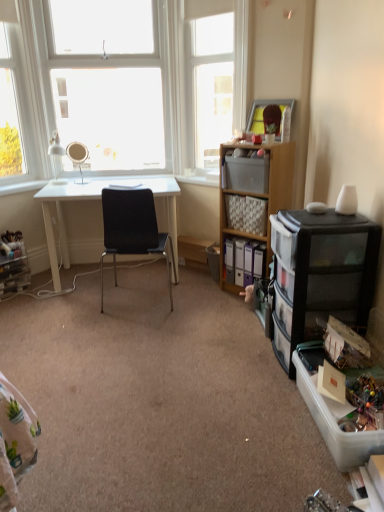
You are a GUI agent. You are given a task and a screenshot of the screen. Output one action in this format:
    pyautogui.click(x=<x>, y=<y>)
    Task: Click on the vacant area that lies to the right of clear plastic drawers at lower left, which is counted as the second shelf, starting from the top
    Image resolution: width=384 pixels, height=512 pixels.
    Given the screenshot: What is the action you would take?
    pyautogui.click(x=40, y=292)